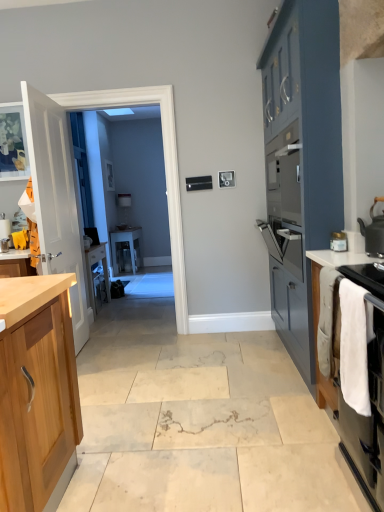
Question: In terms of height, does white glossy countertop at right look taller or shorter compared to clear glass door at center?

Choices:
 (A) short
 (B) tall

Answer: (A)

Question: Would you say white glossy countertop at right is inside or outside clear glass door at center?

Choices:
 (A) inside
 (B) outside

Answer: (B)

Question: Which object is positioned farthest from the matte black kettle at upper right?

Choices:
 (A) clear glass door at center
 (B) white fabric towel at right
 (C) clear glass table at center
 (D) matte blue cabinet at right
 (E) white glossy countertop at right

Answer: (C)

Question: Which of these objects is positioned closest to the white fabric towel at right?

Choices:
 (A) clear glass door at center
 (B) white glossy countertop at right
 (C) clear glass table at center
 (D) matte black kettle at upper right
 (E) white wood door at left

Answer: (B)